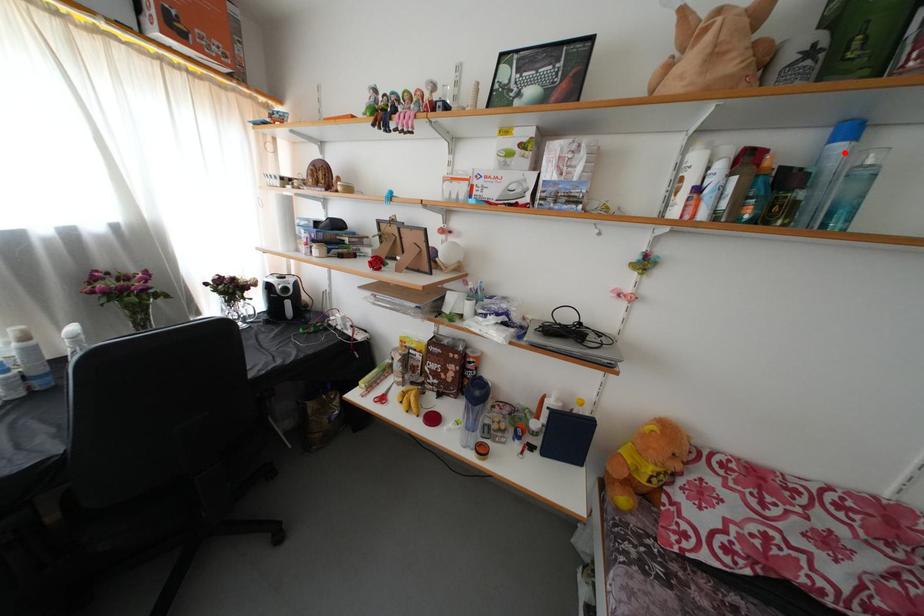
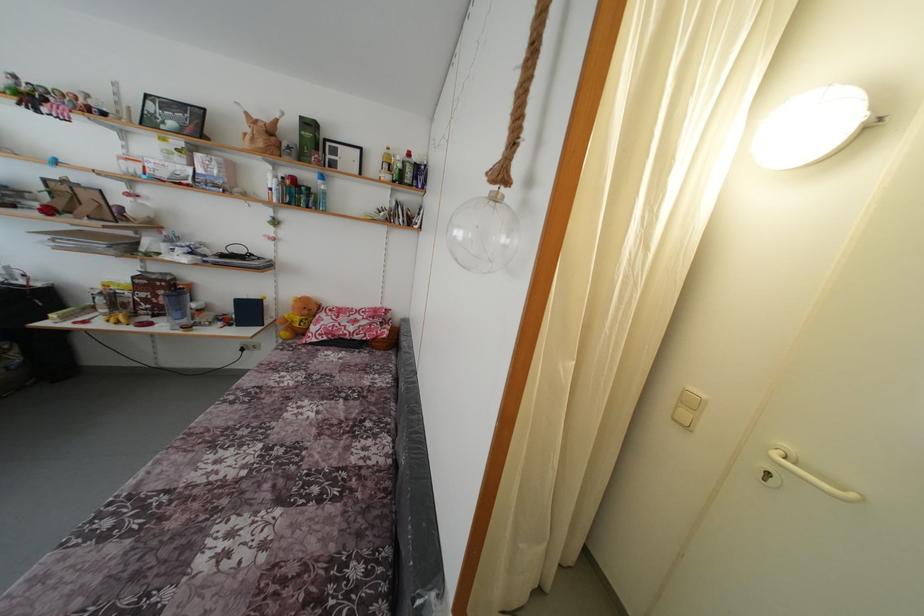
Where in the second image is the point corresponding to the highlighted location from the first image?

(324, 188)